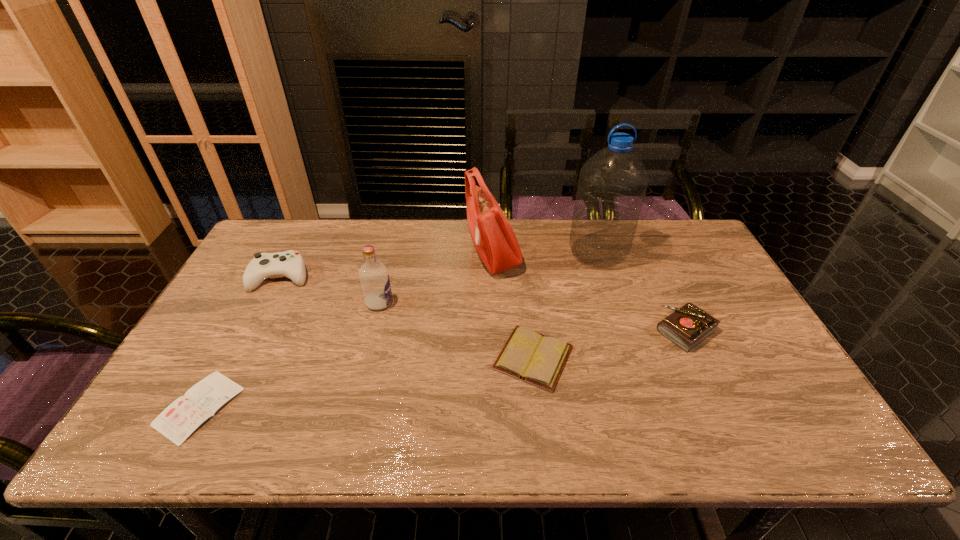
Identify the location of water jug that is at the far edge. Image resolution: width=960 pixels, height=540 pixels. (612, 186).

In order to click on handbag present at the far edge in this screenshot , I will do click(494, 239).

Where is `object at the near edge`? This screenshot has height=540, width=960. object at the near edge is located at coordinates (181, 418).

Where is `control that is at the left edge`? The height and width of the screenshot is (540, 960). control that is at the left edge is located at coordinates (290, 264).

Where is `diary that is positioned at the left edge`? diary that is positioned at the left edge is located at coordinates (181, 418).

The width and height of the screenshot is (960, 540). What are the coordinates of `object located in the right edge section of the desktop` in the screenshot? It's located at (688, 326).

Identify the location of object present at the near left corner. The image size is (960, 540). (181, 418).

Find the location of `vacant space at the far edge`. vacant space at the far edge is located at coordinates (456, 230).

Locate an element on the screen. The width and height of the screenshot is (960, 540). free space at the left edge of the desktop is located at coordinates (257, 333).

This screenshot has height=540, width=960. In the image, there is a desktop. Find the location of `vacant space at the right edge`. vacant space at the right edge is located at coordinates (758, 334).